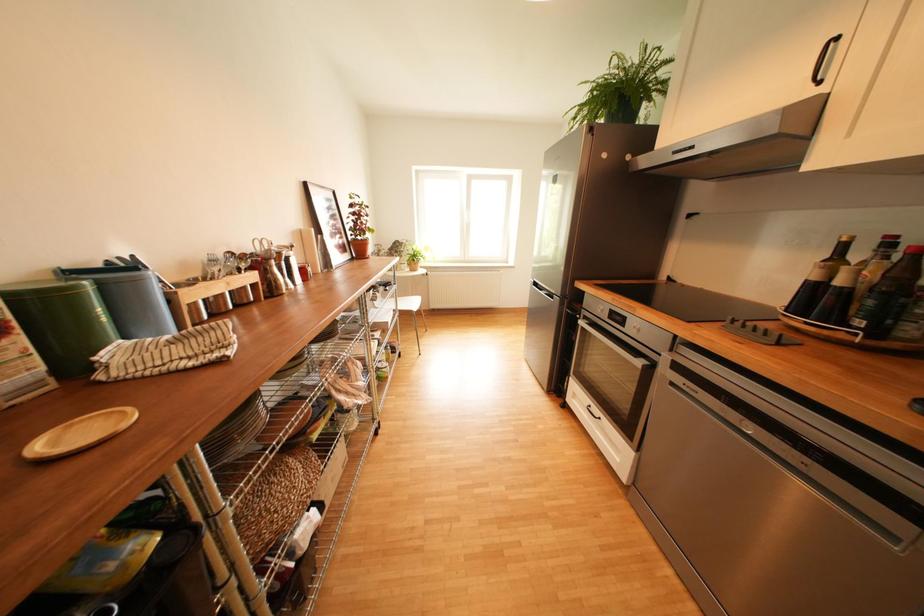
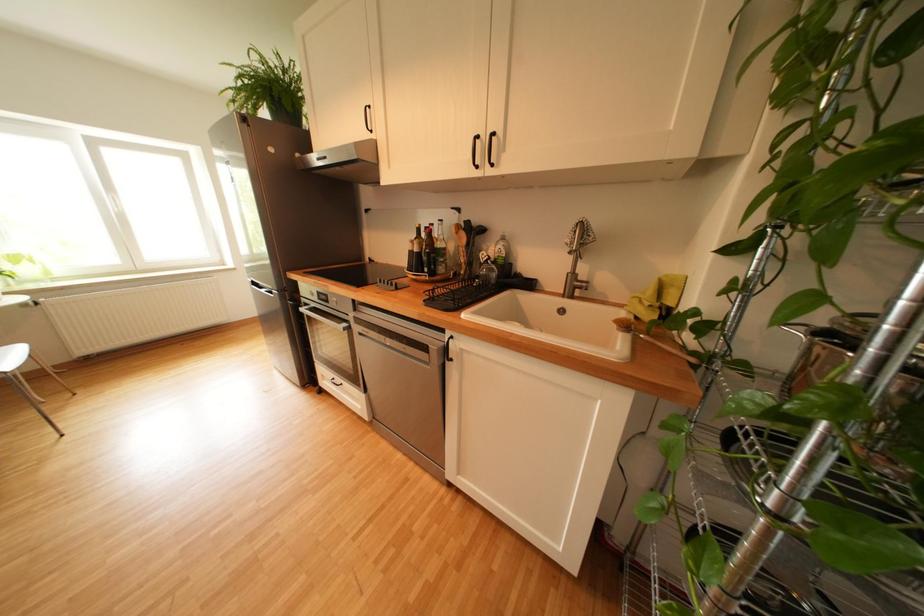
Question: How did the camera likely rotate?

Choices:
 (A) Left
 (B) Right
 (C) Up
 (D) Down

Answer: (B)